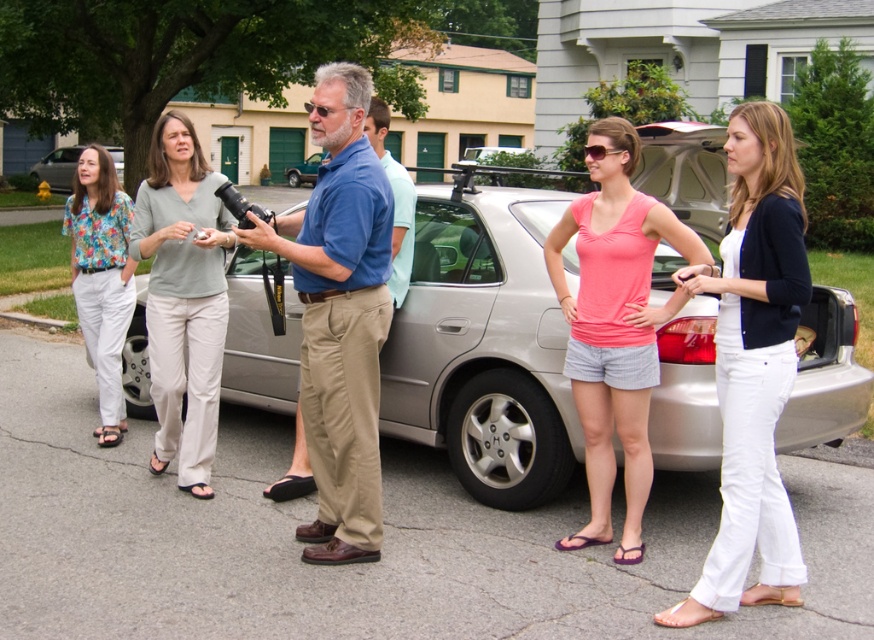
Question: Which of the following is the farthest from the observer?

Choices:
 (A) (96, 330)
 (B) (185, 369)
 (C) (689, 362)

Answer: (A)

Question: Can you confirm if pink fabric tank top at center is positioned to the right of floral print blouse at left?

Choices:
 (A) yes
 (B) no

Answer: (A)

Question: Which point is farther from the camera taking this photo?

Choices:
 (A) (593, 481)
 (B) (112, 172)
 (C) (522, 356)
 (D) (125, 224)

Answer: (B)

Question: Can you confirm if blue cotton shirt at center is smaller than light beige pants at center?

Choices:
 (A) no
 (B) yes

Answer: (B)

Question: Which object is farther from the camera taking this photo?

Choices:
 (A) white cotton pants at center
 (B) satin silver sedan at center

Answer: (B)

Question: Is satin silver sedan at center below matte silver sedan at left?

Choices:
 (A) yes
 (B) no

Answer: (A)